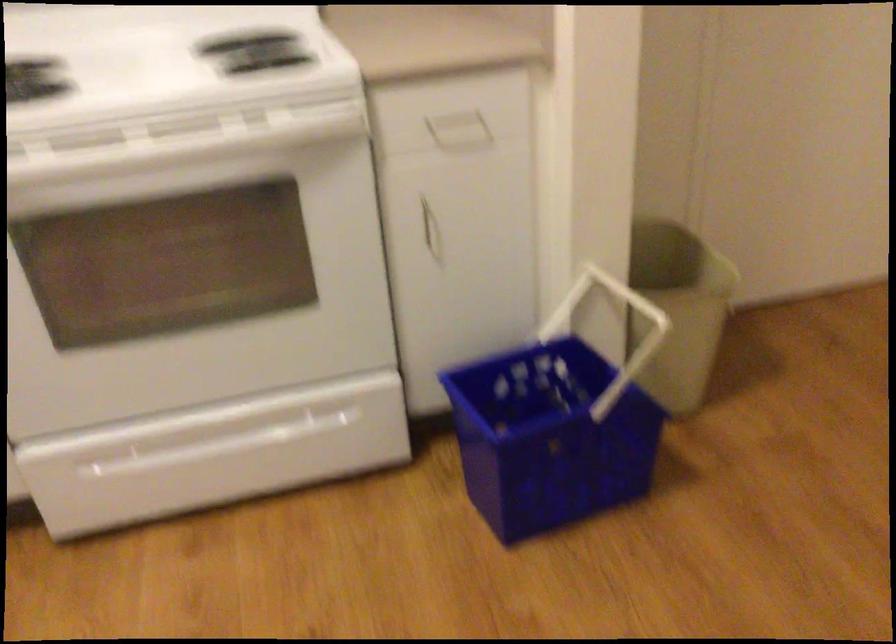
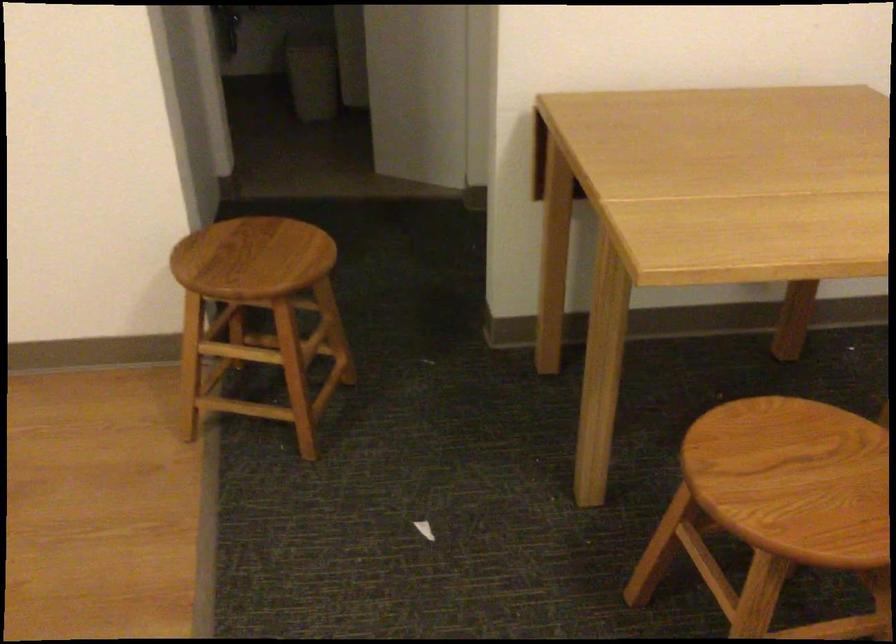
The images are taken continuously from a first-person perspective. In which direction is your viewpoint rotating?

The rotation direction of the camera is right-down.